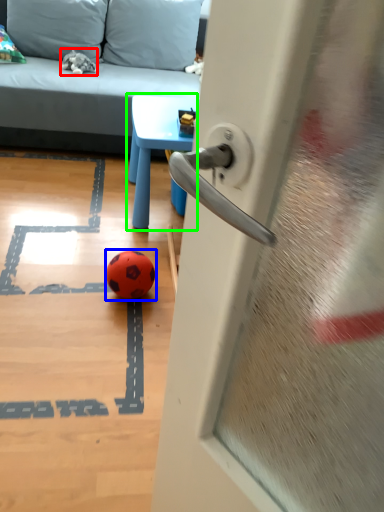
Question: Based on their relative distances, which object is farther from miniature (highlighted by a red box)? Choose from ball (highlighted by a blue box) and table (highlighted by a green box).

Choices:
 (A) ball
 (B) table

Answer: (A)